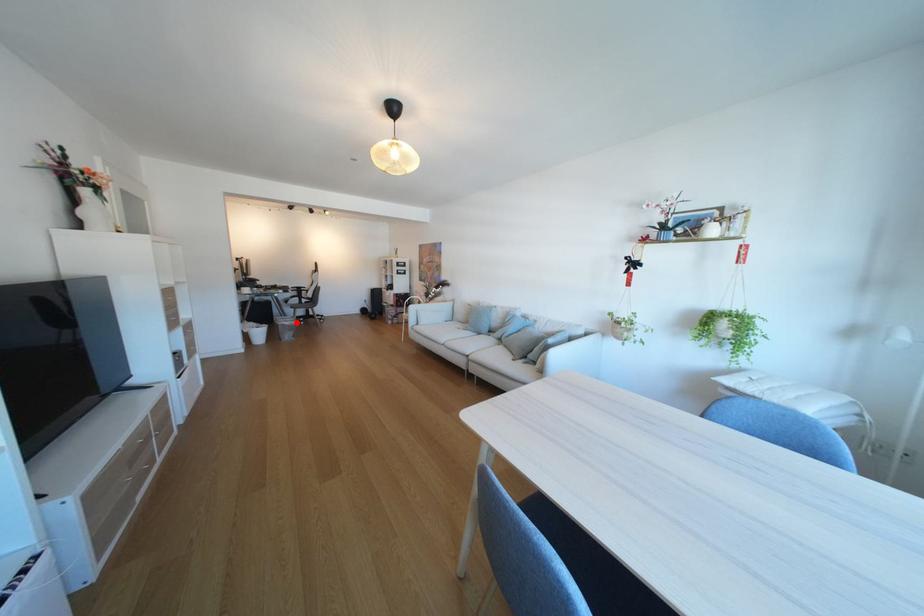
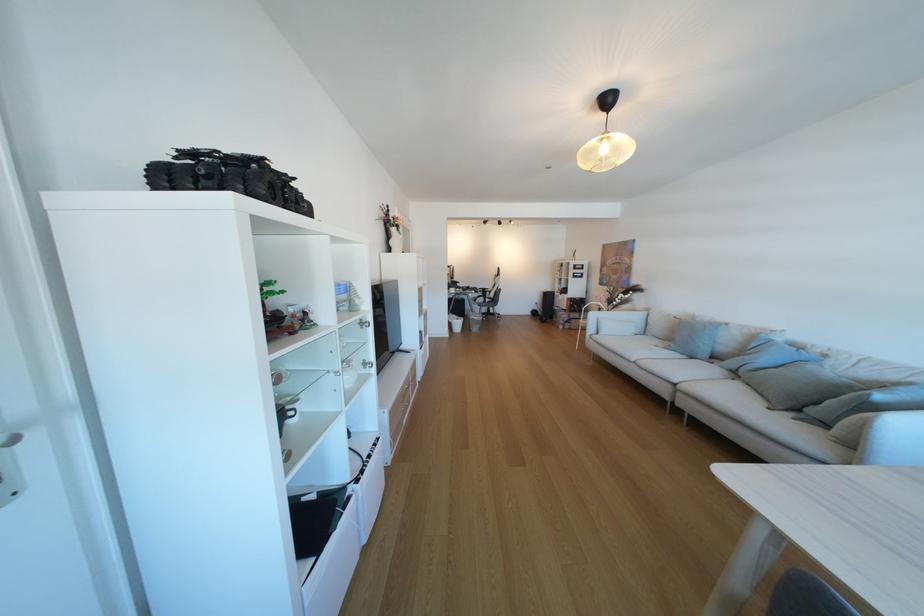
Question: I am providing you with two images of the same scene from different viewpoints. Image1 has a red point marked. In image2, the corresponding 3D location appears at what relative position? Reply with the corresponding letter.

Choices:
 (A) Closer
 (B) Farther

Answer: (B)